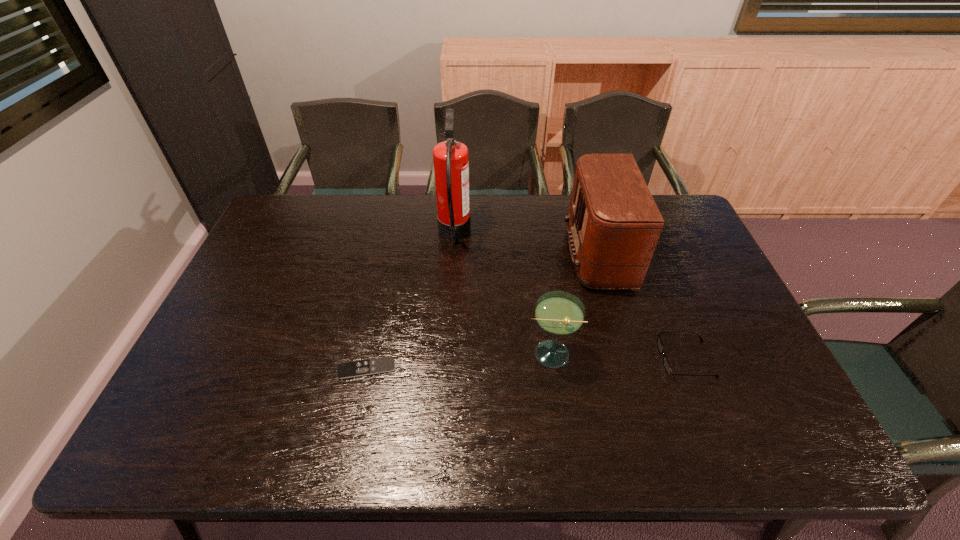
Where is `the second object from left to right`? The width and height of the screenshot is (960, 540). the second object from left to right is located at coordinates (451, 158).

Find the location of a particular element. The width and height of the screenshot is (960, 540). fire extinguisher is located at coordinates (451, 158).

The height and width of the screenshot is (540, 960). Identify the location of radio receiver. (614, 224).

What are the coordinates of `the third shortest object` in the screenshot? It's located at pyautogui.click(x=559, y=313).

The height and width of the screenshot is (540, 960). Find the location of `the third object from left to right`. the third object from left to right is located at coordinates (559, 313).

Identify the location of spectacles. Image resolution: width=960 pixels, height=540 pixels. (667, 366).

Locate an element on the screen. The width and height of the screenshot is (960, 540). remote control is located at coordinates (385, 364).

Locate an element on the screen. the leftmost object is located at coordinates (385, 364).

You are a GUI agent. You are given a task and a screenshot of the screen. Output one action in this format:
    pyautogui.click(x=<x>, y=<y>)
    Task: Click on the vacant space located on the front-facing side of the fourth object from right to left
    The width and height of the screenshot is (960, 540).
    Given the screenshot: What is the action you would take?
    pyautogui.click(x=575, y=235)

Where is `blank area located 0.060m on the front panel of the fourth shortest object`? blank area located 0.060m on the front panel of the fourth shortest object is located at coordinates (547, 255).